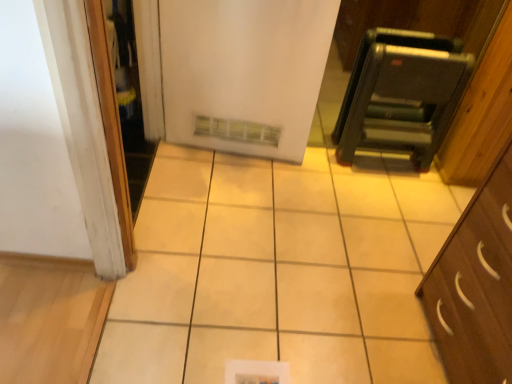
Locate an element on the screen. This screenshot has height=384, width=512. vacant space in front of white matte refrigerator at center is located at coordinates (221, 216).